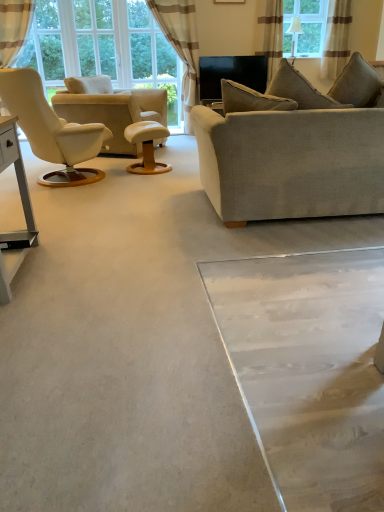
Where is `unoccupied region to the right of white wood table at left`? unoccupied region to the right of white wood table at left is located at coordinates (81, 270).